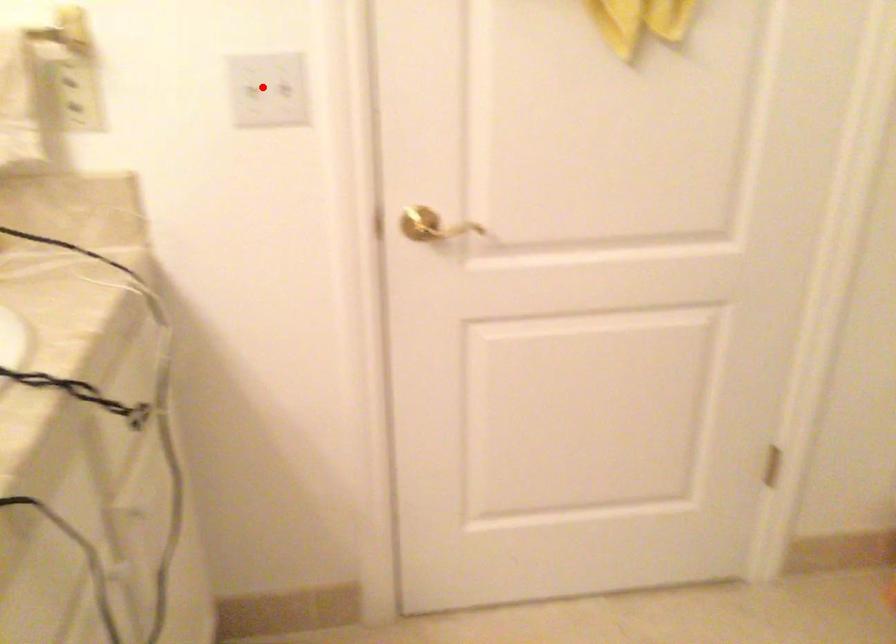
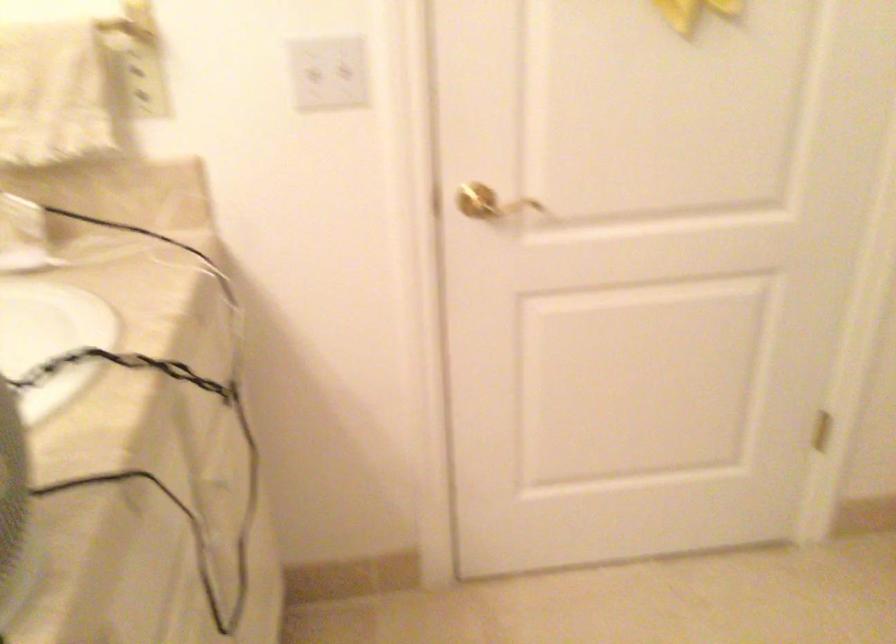
Where in the second image is the point corresponding to the highlighted location from the first image?

(323, 69)